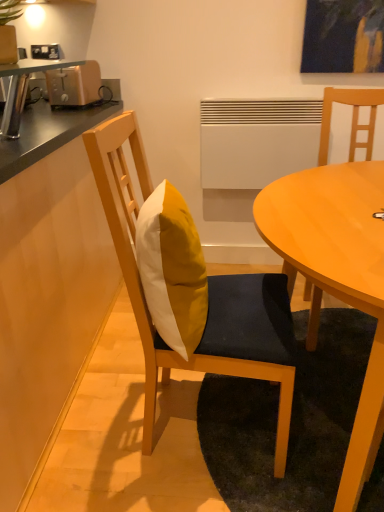
What do you see at coordinates (172, 269) in the screenshot?
I see `yellow fabric pillow at center` at bounding box center [172, 269].

Image resolution: width=384 pixels, height=512 pixels. Identify the location of metallic gold toaster at left. (74, 85).

What are the coordinates of `matte wood table at center` in the screenshot? It's located at (336, 276).

Locate an element on the screen. The height and width of the screenshot is (512, 384). yellow fabric pillow at center is located at coordinates (172, 269).

Can you confirm if matte wood chair at center, placed as the first chair when sorted from right to left, is smaller than wooden countertop at left?

Yes, matte wood chair at center, placed as the first chair when sorted from right to left, is smaller than wooden countertop at left.

Could you tell me if matte wood chair at center, which is the second chair from left to right, is turned towards wooden countertop at left?

No, matte wood chair at center, which is the second chair from left to right, does not turn towards wooden countertop at left.

How distant is matte wood chair at center, which is the second chair from left to right, from wooden countertop at left?

1.17 meters.

From the image's perspective, which is above, matte wood chair at center, placed as the first chair when sorted from right to left, or wooden countertop at left?

matte wood chair at center, placed as the first chair when sorted from right to left, appears higher in the image.

The image size is (384, 512). Find the location of `toaster above the yellow fabric pillow at center (from a real-world perspective)`. toaster above the yellow fabric pillow at center (from a real-world perspective) is located at coordinates (74, 85).

Measure the distance between metallic gold toaster at left and yellow fabric pillow at center.

The distance of metallic gold toaster at left from yellow fabric pillow at center is 1.07 meters.

How many degrees apart are the facing directions of metallic gold toaster at left and yellow fabric pillow at center?

The angular difference between metallic gold toaster at left and yellow fabric pillow at center is 98.6 degrees.

Looking at their sizes, would you say metallic gold toaster at left is wider or thinner than yellow fabric pillow at center?

Clearly, metallic gold toaster at left has more width compared to yellow fabric pillow at center.

Does yellow fabric pillow at center lie in front of matte wood table at center?

No, it is not.

Is point (178, 212) farther from camera compared to point (339, 505)?

Yes, it is behind point (339, 505).

From the image's perspective, which object appears higher, yellow fabric pillow at center or matte wood table at center?

yellow fabric pillow at center.

Can you tell me how much metallic gold toaster at left and matte wood chair at center, placed as the first chair when sorted from right to left, differ in facing direction?

metallic gold toaster at left and matte wood chair at center, placed as the first chair when sorted from right to left, are facing 2.41 degrees away from each other.

From the image's perspective, between metallic gold toaster at left and matte wood chair at center, placed as the first chair when sorted from right to left, which one is located above?

metallic gold toaster at left appears higher in the image.

Does point (73, 90) lie in front of point (355, 144)?

No, it is not.

Would you say metallic gold toaster at left is outside matte wood chair at center, placed as the first chair when sorted from right to left?

metallic gold toaster at left lies outside matte wood chair at center, placed as the first chair when sorted from right to left,'s area.

From a real-world perspective, between wooden countertop at left and matte wood chair at center, which is the second chair from left to right, who is vertically lower?

wooden countertop at left, from a real-world perspective.

From the image's perspective, does wooden countertop at left appear higher than matte wood chair at center, which is the second chair from left to right?

No, from the image's perspective, wooden countertop at left is not on top of matte wood chair at center, which is the second chair from left to right.

Looking at their sizes, would you say wooden countertop at left is wider or thinner than matte wood chair at center, which is the second chair from left to right?

In the image, wooden countertop at left appears to be wider than matte wood chair at center, which is the second chair from left to right.

Are wooden countertop at left and yellow fabric cushion at center, which is the first chair from left to right, located far from each other?

No, wooden countertop at left is in close proximity to yellow fabric cushion at center, which is the first chair from left to right.

Looking at this image, looking at the image, does wooden countertop at left seem bigger or smaller compared to yellow fabric cushion at center, marked as the second chair in a right-to-left arrangement?

wooden countertop at left is bigger than yellow fabric cushion at center, marked as the second chair in a right-to-left arrangement.

From a real-world perspective, does wooden countertop at left sit lower than yellow fabric cushion at center, which is the first chair from left to right?

Yes.

Is wooden countertop at left thinner than yellow fabric cushion at center, marked as the second chair in a right-to-left arrangement?

No, wooden countertop at left is not thinner than yellow fabric cushion at center, marked as the second chair in a right-to-left arrangement.

Are yellow fabric cushion at center, marked as the second chair in a right-to-left arrangement, and matte wood table at center beside each other?

yellow fabric cushion at center, marked as the second chair in a right-to-left arrangement, is not next to matte wood table at center, and they're not touching.

In the scene shown: Is yellow fabric cushion at center, which is the first chair from left to right, wider than matte wood table at center?

In fact, yellow fabric cushion at center, which is the first chair from left to right, might be narrower than matte wood table at center.

Which of these two, yellow fabric cushion at center, which is the first chair from left to right, or matte wood table at center, is smaller?

Smaller between the two is yellow fabric cushion at center, which is the first chair from left to right.

The width and height of the screenshot is (384, 512). Identify the location of chair above the wooden countertop at left (from the image's perspective). (352, 119).

Identify the location of toaster on the left of the yellow fabric pillow at center. The image size is (384, 512). (74, 85).

Based on their spatial positions, is yellow fabric cushion at center, marked as the second chair in a right-to-left arrangement, or wooden countertop at left closer to matte wood chair at center, placed as the first chair when sorted from right to left?

yellow fabric cushion at center, marked as the second chair in a right-to-left arrangement.

Based on their spatial positions, is wooden countertop at left or yellow fabric pillow at center closer to yellow fabric cushion at center, which is the first chair from left to right?

yellow fabric pillow at center.

Considering their positions, is matte wood chair at center, which is the second chair from left to right, positioned closer to metallic gold toaster at left than yellow fabric pillow at center?

yellow fabric pillow at center is positioned closer to the anchor metallic gold toaster at left.

Estimate the real-world distances between objects in this image. Which object is closer to matte wood chair at center, which is the second chair from left to right, yellow fabric cushion at center, marked as the second chair in a right-to-left arrangement, or yellow fabric pillow at center?

Among the two, yellow fabric cushion at center, marked as the second chair in a right-to-left arrangement, is located nearer to matte wood chair at center, which is the second chair from left to right.

Based on their spatial positions, is matte wood chair at center, which is the second chair from left to right, or wooden countertop at left closer to matte wood table at center?

matte wood chair at center, which is the second chair from left to right, lies closer to matte wood table at center than the other object.

Estimate the real-world distances between objects in this image. Which object is closer to matte wood chair at center, placed as the first chair when sorted from right to left, matte wood table at center or wooden countertop at left?

Based on the image, matte wood table at center appears to be nearer to matte wood chair at center, placed as the first chair when sorted from right to left.

Based on the photo, from the image, which object appears to be nearer to metallic gold toaster at left, yellow fabric cushion at center, marked as the second chair in a right-to-left arrangement, or matte wood chair at center, which is the second chair from left to right?

Based on the image, yellow fabric cushion at center, marked as the second chair in a right-to-left arrangement, appears to be nearer to metallic gold toaster at left.

Looking at the image, which one is located further to matte wood chair at center, placed as the first chair when sorted from right to left, wooden countertop at left or yellow fabric cushion at center, which is the first chair from left to right?

wooden countertop at left lies further to matte wood chair at center, placed as the first chair when sorted from right to left, than the other object.

In order to click on desk located between metallic gold toaster at left and matte wood chair at center, placed as the first chair when sorted from right to left, in the left-right direction in this screenshot , I will do `click(336, 276)`.

Where is `chair situated between yellow fabric pillow at center and matte wood table at center from left to right`? chair situated between yellow fabric pillow at center and matte wood table at center from left to right is located at coordinates (209, 294).

The height and width of the screenshot is (512, 384). Find the location of `toaster situated between wooden countertop at left and matte wood table at center from left to right`. toaster situated between wooden countertop at left and matte wood table at center from left to right is located at coordinates (74, 85).

Locate an element on the screen. pillow between wooden countertop at left and matte wood chair at center, placed as the first chair when sorted from right to left, from left to right is located at coordinates (172, 269).